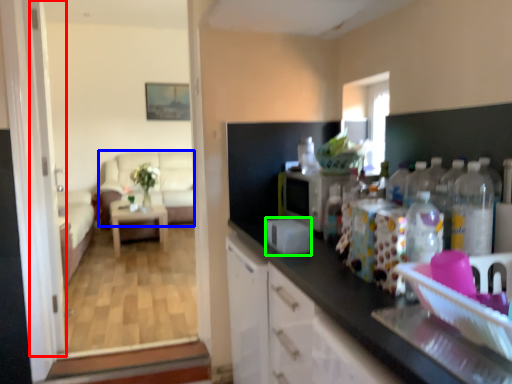
Question: Which object is positioned closest to screen door (highlighted by a red box)? Select from couch (highlighted by a blue box) and appliance (highlighted by a green box).

Choices:
 (A) couch
 (B) appliance

Answer: (B)